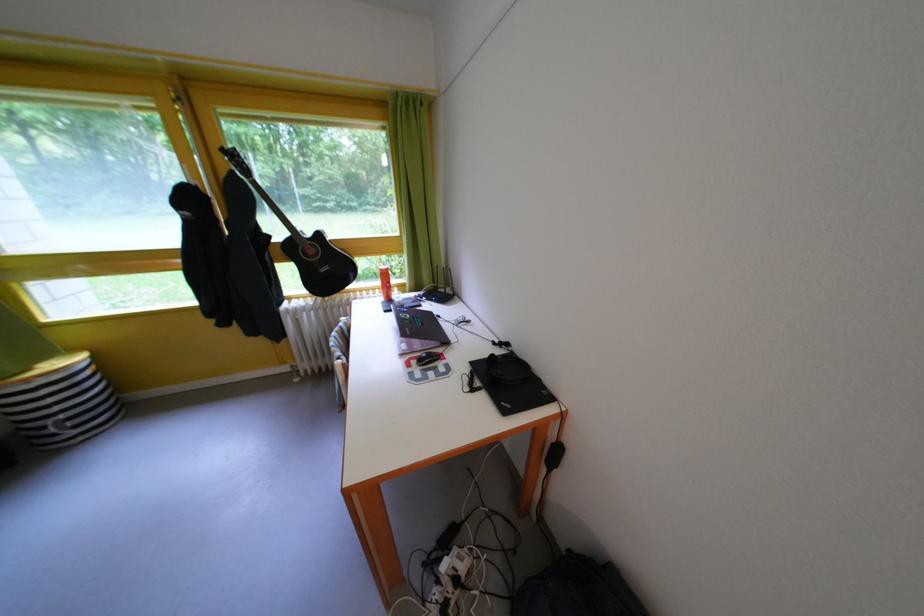
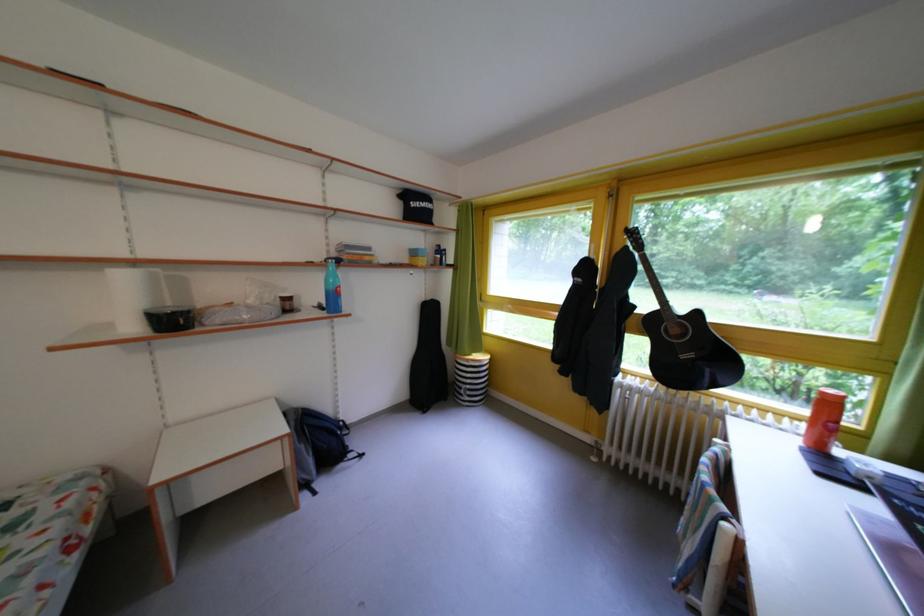
Locate, in the second image, the point that corresponds to [333,276] in the first image.

(693, 362)